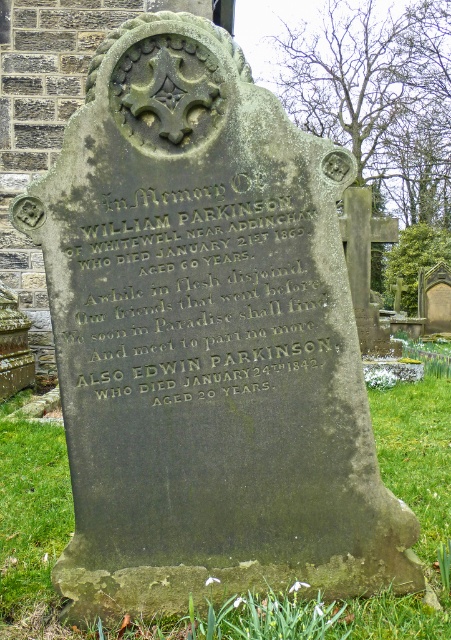
Question: Which object is closer to the camera taking this photo?

Choices:
 (A) green grass at lower center
 (B) black stone inscription at center

Answer: (B)

Question: Among these objects, which one is farthest from the camera?

Choices:
 (A) green grass at lower center
 (B) black stone inscription at center

Answer: (A)

Question: Which point is closer to the camera taking this photo?

Choices:
 (A) (119, 272)
 (B) (55, 460)

Answer: (A)

Question: Does black stone inscription at center appear under green grass at lower center?

Choices:
 (A) no
 (B) yes

Answer: (A)

Question: Does black stone inscription at center appear under green grass at lower center?

Choices:
 (A) yes
 (B) no

Answer: (B)

Question: Is black stone inscription at center above green grass at lower center?

Choices:
 (A) yes
 (B) no

Answer: (A)